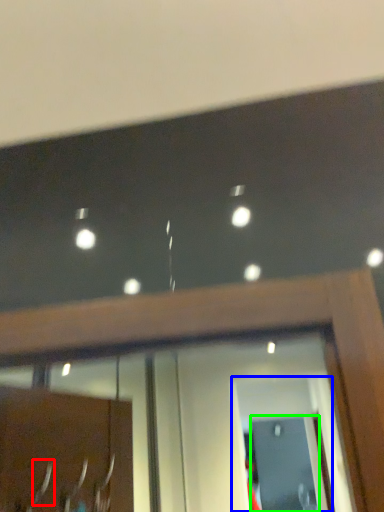
Question: Which object is the farthest from door handle (highlighted by a red box)? Choose among these: screen door (highlighted by a blue box) or screen door (highlighted by a green box).

Choices:
 (A) screen door
 (B) screen door

Answer: (B)